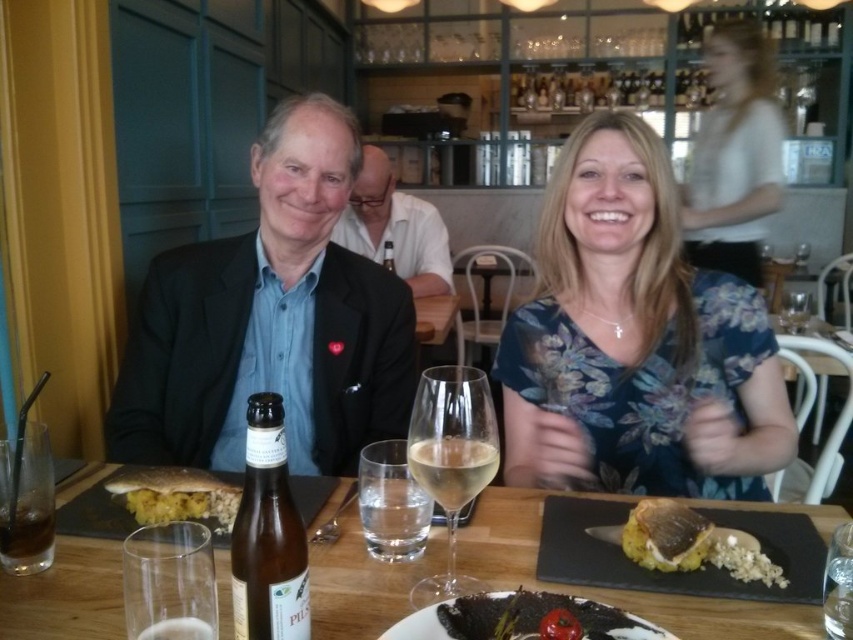
You are a waiter in a restaurant. You need to place a new order of a salad and a dessert on the table where the clear glass wine glass at center and the yellow crumbly at lower right are located. Where should you place the salad plate and the dessert plate so that they don not interfere with the existing items?

Place the salad plate above the clear glass wine glass at center and the dessert plate below the yellow crumbly at lower right to avoid interference with existing items.

Based on the photo, you are a restaurant server who just arrived at the table. You need to place a new menu on the table. Where should you put it so it doesn not block the clear glass wine at center and the smooth black plate at lower center?

The smooth black plate at lower center is in front of the clear glass wine at center. To avoid blocking both items, place the new menu between them, ensuring it doesn not cover either object.

You are a waiter at this restaurant and need to place a dessert menu on the table. The menu is too large to fit between the clear glass wine glass at center and the yellow crumbly at lower right. Which object should you move to make space?

You should move the yellow crumbly at lower right because the clear glass wine glass at center is closer to the viewer and likely in a more central position, making it harder to move. The yellow crumbly at lower right is farther away and easier to shift to create space.